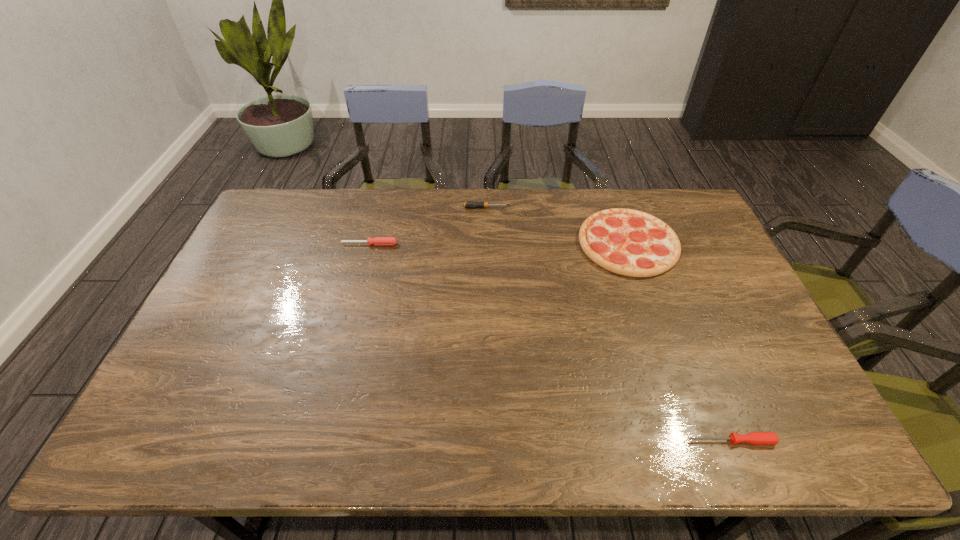
The height and width of the screenshot is (540, 960). In the image, there is a desktop. Find the location of `vacant space at the far edge`. vacant space at the far edge is located at coordinates (390, 217).

This screenshot has height=540, width=960. Identify the location of free space at the near edge of the desktop. (332, 420).

The width and height of the screenshot is (960, 540). Identify the location of vacant space at the left edge of the desktop. (230, 266).

Where is `vacant region at the right edge of the desktop`? This screenshot has width=960, height=540. vacant region at the right edge of the desktop is located at coordinates (705, 270).

Locate an element on the screen. vacant space at the far left corner of the desktop is located at coordinates (265, 212).

This screenshot has width=960, height=540. In the image, there is a desktop. In order to click on free space at the near left corner in this screenshot , I will do tap(207, 434).

Locate an element on the screen. free space between the pizza and the farthest object is located at coordinates (557, 226).

Where is `free space between the rightmost screwdriver and the leftmost screwdriver`? This screenshot has width=960, height=540. free space between the rightmost screwdriver and the leftmost screwdriver is located at coordinates (550, 342).

Identify the location of free space between the leftmost object and the pizza. (499, 244).

Identify the location of vacant region between the leftmost screwdriver and the pizza. (499, 244).